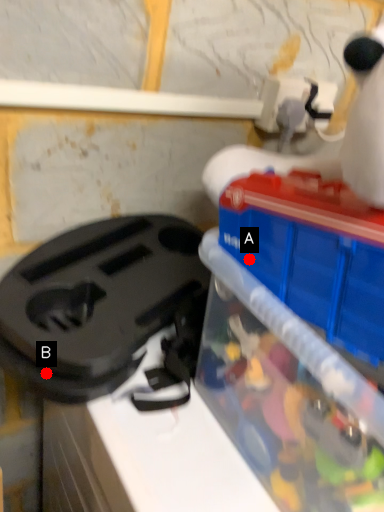
Question: Two points are circled on the image, labeled by A and B beside each circle. Which point is farther to the camera?

Choices:
 (A) A is further
 (B) B is further

Answer: (B)